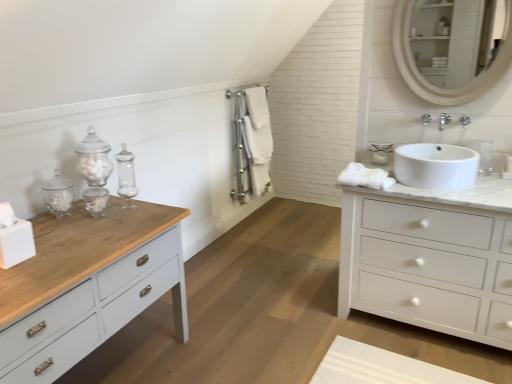
Question: Could you tell me if white glossy sink at right is turned towards white matte chest of drawers at right?

Choices:
 (A) yes
 (B) no

Answer: (B)

Question: From the image's perspective, is white glossy sink at right above white matte chest of drawers at right?

Choices:
 (A) yes
 (B) no

Answer: (A)

Question: Does white glossy sink at right come in front of white matte chest of drawers at right?

Choices:
 (A) no
 (B) yes

Answer: (A)

Question: From a real-world perspective, is white glossy sink at right over white matte chest of drawers at right?

Choices:
 (A) yes
 (B) no

Answer: (A)

Question: Can you confirm if white glossy sink at right is bigger than white matte chest of drawers at right?

Choices:
 (A) yes
 (B) no

Answer: (B)

Question: Is there a large distance between white glossy sink at right and white matte chest of drawers at right?

Choices:
 (A) yes
 (B) no

Answer: (B)

Question: From the image's perspective, is white glossy sink at right on white cotton towel at center, arranged as the second bath towel when viewed from the left?

Choices:
 (A) no
 (B) yes

Answer: (A)

Question: Can you confirm if white glossy sink at right is positioned to the right of white cotton towel at center, which is the third bath towel in front-to-back order?

Choices:
 (A) no
 (B) yes

Answer: (B)

Question: Considering the relative positions of white glossy sink at right and white cotton towel at center, arranged as the second bath towel when viewed from the left, in the image provided, is white glossy sink at right to the left of white cotton towel at center, arranged as the second bath towel when viewed from the left, from the viewer's perspective?

Choices:
 (A) no
 (B) yes

Answer: (A)

Question: Can white cotton towel at center, the first bath towel from the back, be found inside white glossy sink at right?

Choices:
 (A) yes
 (B) no

Answer: (B)

Question: From a real-world perspective, is white glossy sink at right located higher than white cotton towel at center, which is the third bath towel in front-to-back order?

Choices:
 (A) yes
 (B) no

Answer: (B)

Question: From a real-world perspective, is white glossy sink at right under white cotton towel at center, arranged as the second bath towel when viewed from the left?

Choices:
 (A) no
 (B) yes

Answer: (B)

Question: Considering the relative positions of white cotton bath towel at center, the 2th bath towel from the front, and white cotton towel at center, the first bath towel from the back, in the image provided, is white cotton bath towel at center, the 2th bath towel from the front, to the right of white cotton towel at center, the first bath towel from the back, from the viewer's perspective?

Choices:
 (A) no
 (B) yes

Answer: (A)